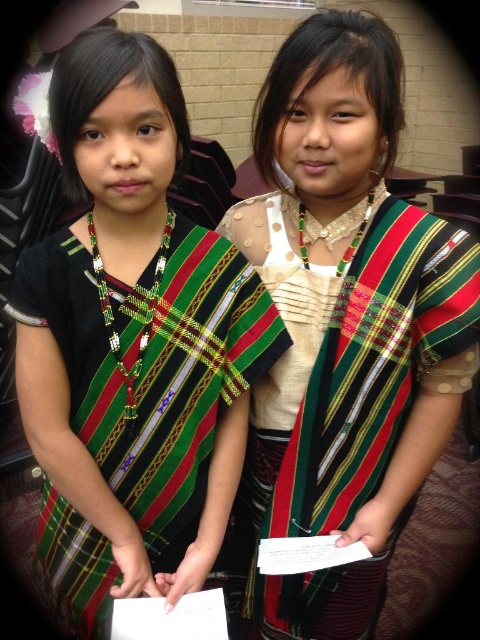
Question: Which point is farther from the camera taking this photo?

Choices:
 (A) (251, 449)
 (B) (51, 580)

Answer: (A)

Question: Among these points, which one is nearest to the camera?

Choices:
 (A) (120, 266)
 (B) (403, 77)

Answer: (A)

Question: Can you confirm if matte black dress at left is positioned to the left of textured woven dress at center?

Choices:
 (A) no
 (B) yes

Answer: (B)

Question: Which of the following is the farthest from the observer?

Choices:
 (A) textured woven dress at center
 (B) matte black dress at left

Answer: (A)

Question: In this image, where is matte black dress at left located relative to textured woven dress at center?

Choices:
 (A) above
 (B) below

Answer: (A)

Question: Can you confirm if matte black dress at left is positioned to the left of textured woven dress at center?

Choices:
 (A) yes
 (B) no

Answer: (A)